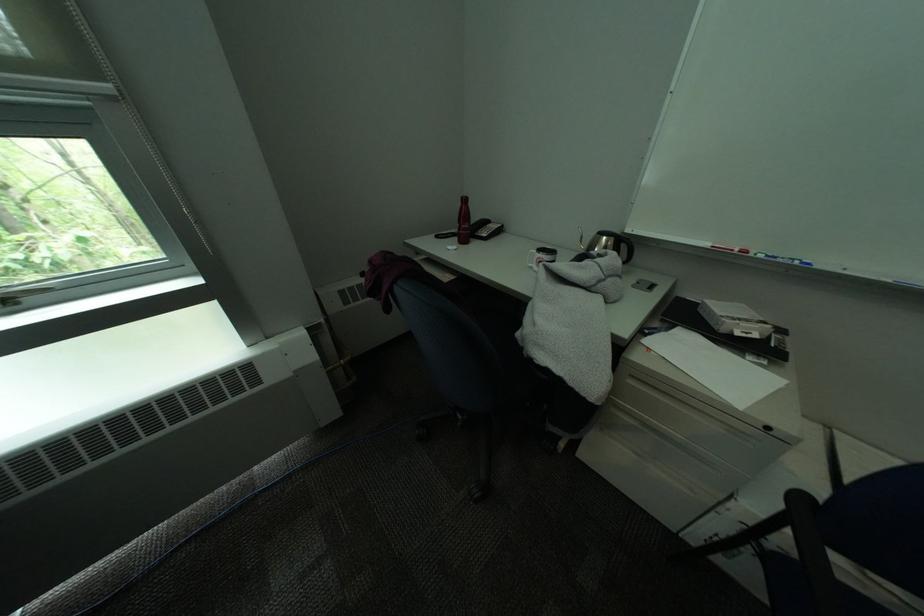
This screenshot has height=616, width=924. Describe the element at coordinates (464, 221) in the screenshot. I see `the red water bottle` at that location.